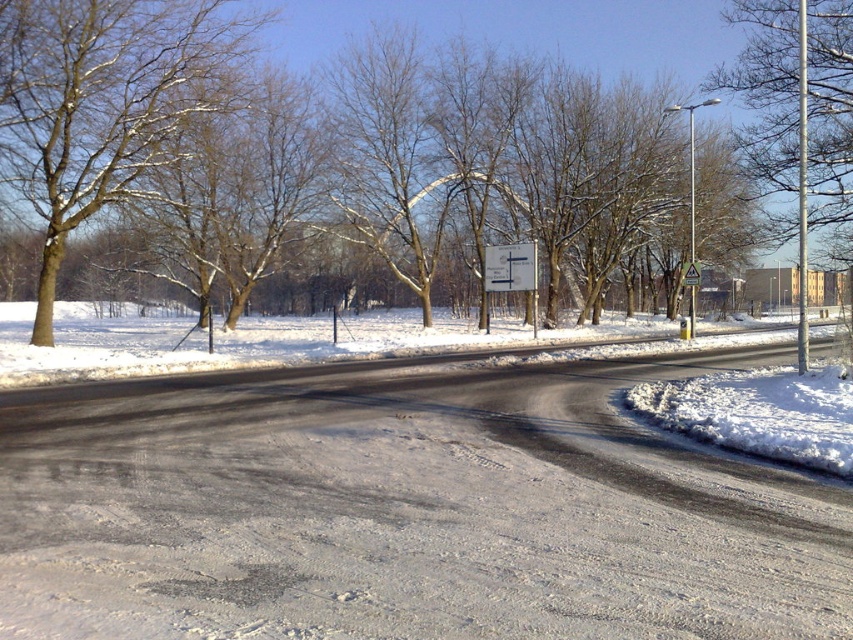
In the scene shown: You are standing at the road intersection in the image. Looking towards the upper right corner of your view, can you see the snowy bare tree at upper right? Please answer based on its 2D location in the image.

Yes, the snowy bare tree at upper right is located at point 2D location of (x=798, y=113), which would be visible in the upper right corner of the view.

You are driving a car and need to park in the area shown. The parking spot is located near the white powdery snow at center. To avoid hitting the metallic triangular sign at upper right, which object should you be cautious of and why?

You should be cautious of the metallic triangular sign at upper right because it is taller than the white powdery snow at center, so it might be in the path of your vehicle when parking near the snow.